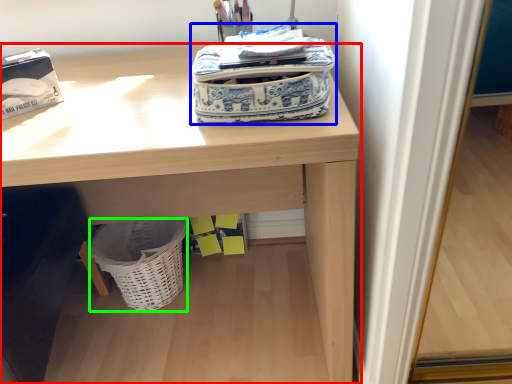
Question: Estimate the real-world distances between objects in this image. Which object is closer to desk (highlighted by a red box), bag (highlighted by a blue box) or basket (highlighted by a green box)?

Choices:
 (A) bag
 (B) basket

Answer: (A)